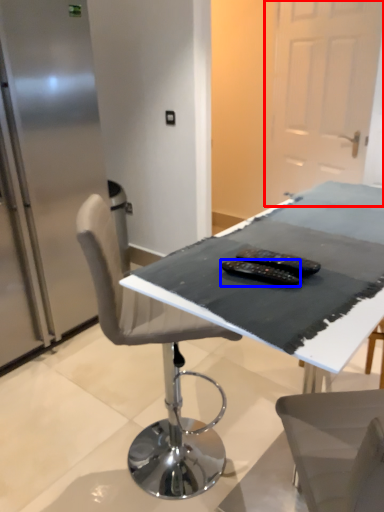
Question: Which of the following is the closest to the observer, glass door (highlighted by a red box) or equipment (highlighted by a blue box)?

Choices:
 (A) glass door
 (B) equipment

Answer: (B)